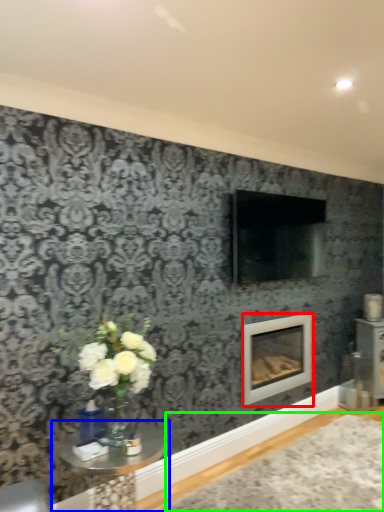
Question: Which object is positioned farthest from fireplace (highlighted by a red box)? Select from table (highlighted by a blue box) and plain (highlighted by a green box).

Choices:
 (A) table
 (B) plain

Answer: (A)